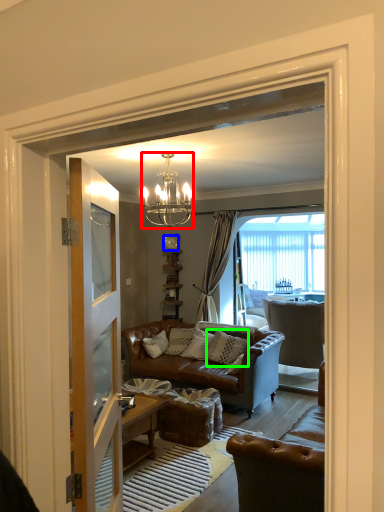
Question: Based on their relative distances, which object is farther from lamp (highlighted by a red box)? Choose from clock (highlighted by a blue box) and pillow (highlighted by a green box).

Choices:
 (A) clock
 (B) pillow

Answer: (A)